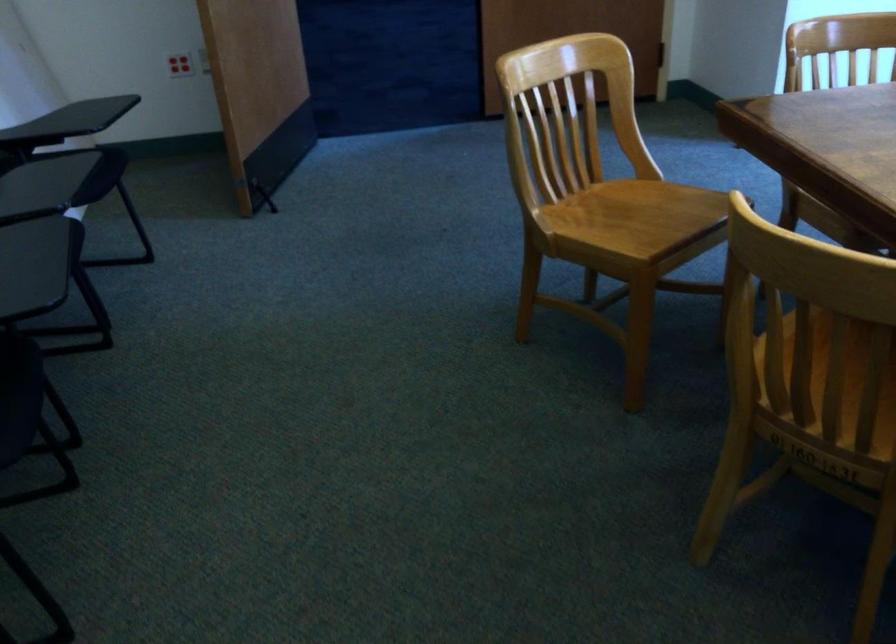
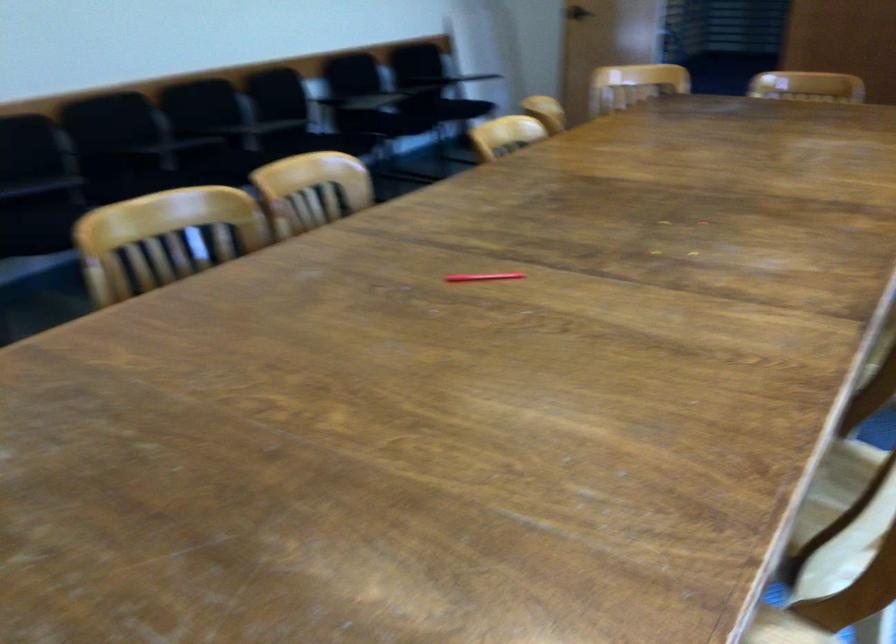
Question: I am providing you with two images of the same scene from different viewpoints. Which of the following objects are not visible in image2?

Choices:
 (A) red pen
 (B) wooden chair sitting surface
 (C) glass soda bottle
 (D) black chair sitting surface

Answer: (B)